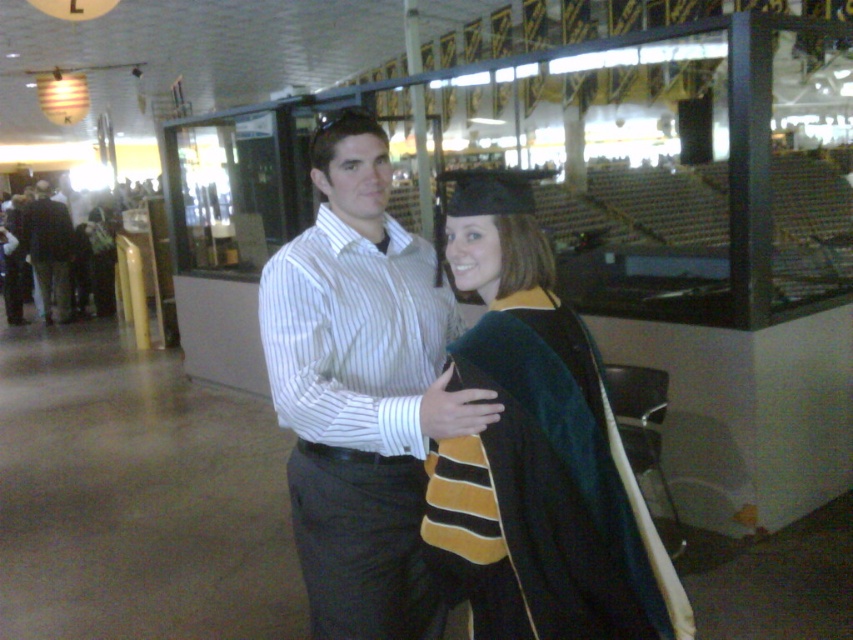
In the graduation ceremony scene, there are two people. One is wearing a striped shirt and dark trousers, and the other is wearing a velvet black graduation gown at center represented by point (538, 449). Which person is closer to the camera?

The velvet black graduation gown at center represented by point (538, 449) is closer to the camera because the point indicates its position in the foreground.

In the scene shown: You are a photographer who needs to capture a closeup shot of the velvet black graduation gown at center without including the dark gray pants at left. Given their sizes, is this possible?

The velvet black graduation gown at center has a smaller size compared to dark gray pants at left, so it is possible to frame the shot to include only the velvet black graduation gown at center and exclude the dark gray pants at left.